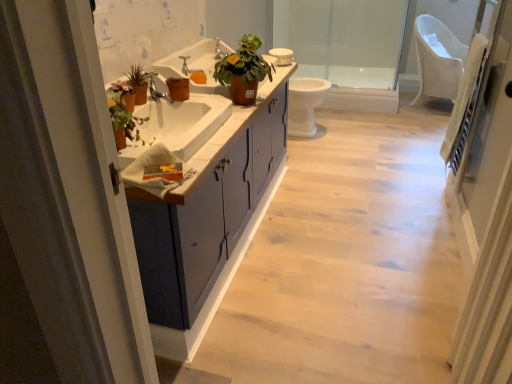
Identify the location of vacant space behind white textured screen door at right. (398, 319).